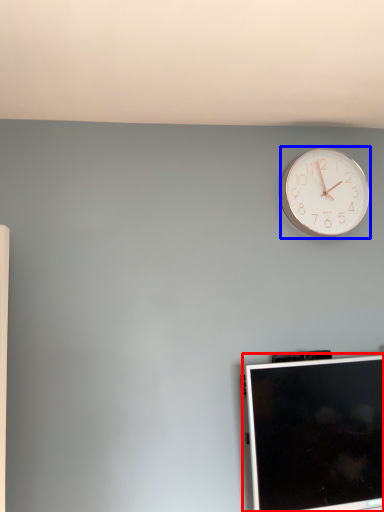
Question: Among these objects, which one is farthest to the camera, computer monitor (highlighted by a red box) or wall clock (highlighted by a blue box)?

Choices:
 (A) computer monitor
 (B) wall clock

Answer: (B)